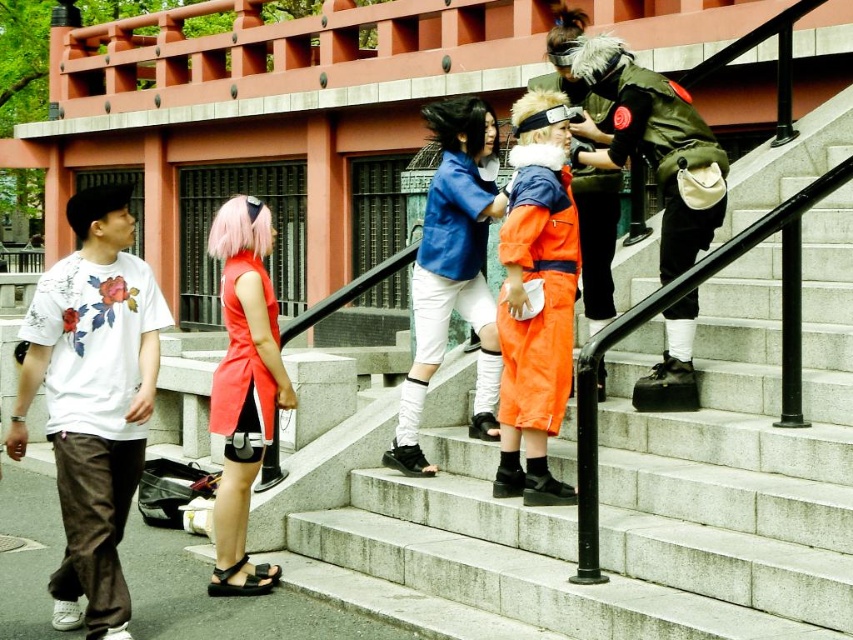
You are a photographer at the shrine and want to capture both the orange fabric jacket at center and the blue fabric jacket at center in a single frame. Which jacket should you focus on first to ensure both are in the shot?

The orange fabric jacket at center is located below the blue fabric jacket at center, so focusing on the lower orange jacket first will allow the photographer to frame both jackets in the shot.

You are a photographer at the shrine and need to capture both the orange fabric jacket at center and the blue fabric jacket at center in a single frame. Which jacket should you position closer to the camera to ensure both are fully visible?

The orange fabric jacket at center is smaller in size compared to the blue fabric jacket at center. To ensure both are fully visible in the frame, position the orange fabric jacket at center closer to the camera so its size matches the blue one in the photo.

Consider the image. What is the position of the blue fabric jacket at center in the image?

The blue fabric jacket at center is located at point (453, 272).